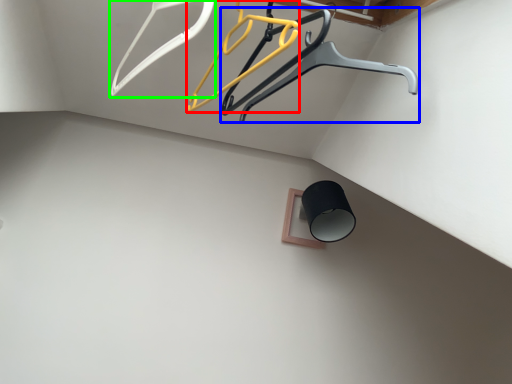
Question: Which is farther away from hanger (highlighted by a red box)? furniture (highlighted by a blue box) or hanger (highlighted by a green box)?

Choices:
 (A) furniture
 (B) hanger

Answer: (B)